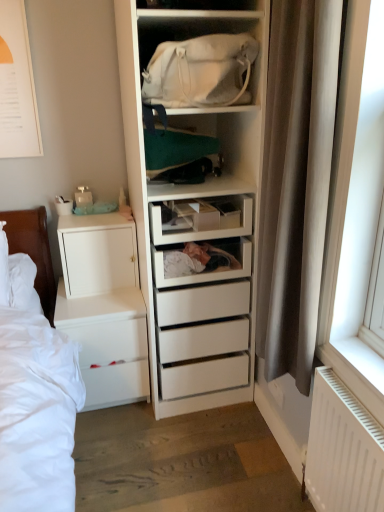
Question: Is the surface of white plastic drawer at center in direct contact with white matte chest of drawers at lower left?

Choices:
 (A) yes
 (B) no

Answer: (B)

Question: Does white plastic drawer at center appear on the right side of white matte chest of drawers at lower left?

Choices:
 (A) yes
 (B) no

Answer: (A)

Question: Is white plastic drawer at center positioned far away from white matte chest of drawers at lower left?

Choices:
 (A) yes
 (B) no

Answer: (B)

Question: Is white plastic drawer at center thinner than white matte chest of drawers at lower left?

Choices:
 (A) yes
 (B) no

Answer: (A)

Question: Does white plastic drawer at center have a greater width compared to white matte chest of drawers at lower left?

Choices:
 (A) no
 (B) yes

Answer: (A)

Question: From a real-world perspective, is white plastic drawer at center located higher than white matte chest of drawers at lower left?

Choices:
 (A) yes
 (B) no

Answer: (A)

Question: Does white fabric bag at upper center have a greater width compared to white matte cabinet at left?

Choices:
 (A) yes
 (B) no

Answer: (B)

Question: Is white fabric bag at upper center further to camera compared to white matte cabinet at left?

Choices:
 (A) yes
 (B) no

Answer: (B)

Question: Is white fabric bag at upper center oriented away from white matte cabinet at left?

Choices:
 (A) no
 (B) yes

Answer: (A)

Question: Does white fabric bag at upper center have a greater height compared to white matte cabinet at left?

Choices:
 (A) no
 (B) yes

Answer: (A)

Question: Is white fabric bag at upper center next to white matte cabinet at left?

Choices:
 (A) no
 (B) yes

Answer: (A)

Question: Does white fabric bag at upper center appear on the right side of white matte cabinet at left?

Choices:
 (A) no
 (B) yes

Answer: (B)

Question: From a real-world perspective, is white fabric bag at upper center below white matte chest of drawers at lower left?

Choices:
 (A) yes
 (B) no

Answer: (B)